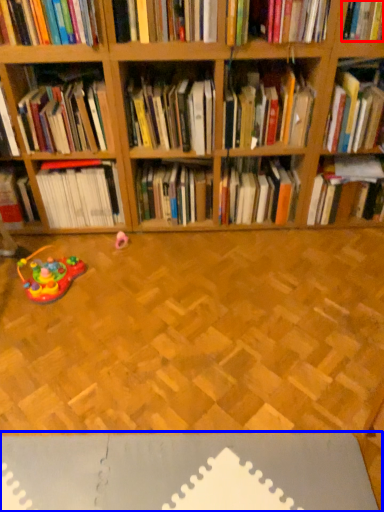
Question: Which object appears closest to the camera in this image, book (highlighted by a red box) or surface (highlighted by a blue box)?

Choices:
 (A) book
 (B) surface

Answer: (B)